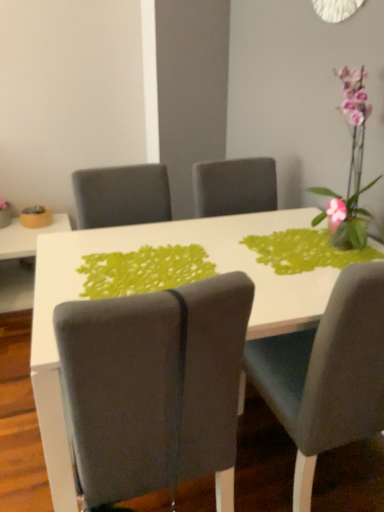
Question: Is suede gray chair at center, which ranks as the 2th chair in right-to-left order, to the left of green fabric placemat at center from the viewer's perspective?

Choices:
 (A) yes
 (B) no

Answer: (A)

Question: From a real-world perspective, is suede gray chair at center, which ranks as the 2th chair in right-to-left order, beneath green fabric placemat at center?

Choices:
 (A) yes
 (B) no

Answer: (A)

Question: Is suede gray chair at center, which ranks as the 2th chair in right-to-left order, taller than green fabric placemat at center?

Choices:
 (A) yes
 (B) no

Answer: (A)

Question: Considering the relative sizes of suede gray chair at center, which ranks as the 2th chair in right-to-left order, and green fabric placemat at center in the image provided, is suede gray chair at center, which ranks as the 2th chair in right-to-left order, shorter than green fabric placemat at center?

Choices:
 (A) yes
 (B) no

Answer: (B)

Question: Is suede gray chair at center, which ranks as the 2th chair in right-to-left order, far from green fabric placemat at center?

Choices:
 (A) yes
 (B) no

Answer: (B)

Question: From the image's perspective, is green fabric placemat at center positioned above or below white glossy table at center, which ranks as the first table in right-to-left order?

Choices:
 (A) above
 (B) below

Answer: (A)

Question: Is green fabric placemat at center situated inside white glossy table at center, the 2th table when ordered from left to right, or outside?

Choices:
 (A) inside
 (B) outside

Answer: (A)

Question: Is point (187, 280) closer or farther from the camera than point (244, 253)?

Choices:
 (A) farther
 (B) closer

Answer: (B)

Question: Is green fabric placemat at center taller or shorter than white glossy table at center, which is the 1th table in front-to-back order?

Choices:
 (A) short
 (B) tall

Answer: (A)

Question: From a real-world perspective, is pink glass vase at upper right above or below matte yellow bowl at left?

Choices:
 (A) below
 (B) above

Answer: (B)

Question: From the image's perspective, is pink glass vase at upper right positioned above or below matte yellow bowl at left?

Choices:
 (A) above
 (B) below

Answer: (A)

Question: Is point (354, 227) closer or farther from the camera than point (1, 208)?

Choices:
 (A) closer
 (B) farther

Answer: (A)

Question: Relative to matte yellow bowl at left, is pink glass vase at upper right in front or behind?

Choices:
 (A) front
 (B) behind

Answer: (A)

Question: Based on their sizes in the image, would you say suede gray chair at center, which appears as the 1th chair when viewed from the left, is bigger or smaller than pink glass vase at upper right?

Choices:
 (A) small
 (B) big

Answer: (A)

Question: Considering the positions of suede gray chair at center, which appears as the 1th chair when viewed from the left, and pink glass vase at upper right in the image, is suede gray chair at center, which appears as the 1th chair when viewed from the left, taller or shorter than pink glass vase at upper right?

Choices:
 (A) short
 (B) tall

Answer: (B)